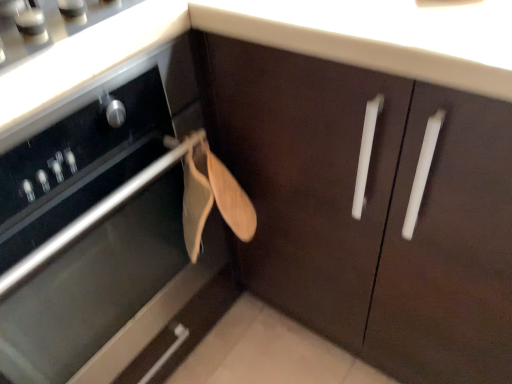
Where is `satin silver gas stove at upper left`? satin silver gas stove at upper left is located at coordinates pyautogui.click(x=48, y=23).

In order to face satin silver gas stove at upper left, should I rotate leftwards or rightwards?

Rotate left and turn 29.077 degrees.

This screenshot has width=512, height=384. What do you see at coordinates (48, 23) in the screenshot? I see `satin silver gas stove at upper left` at bounding box center [48, 23].

What is the approximate width of satin silver gas stove at upper left?

15.15 inches.

What do you see at coordinates (119, 297) in the screenshot?
I see `brown matte cabinet at center` at bounding box center [119, 297].

The width and height of the screenshot is (512, 384). What are the coordinates of `brown matte cabinet at center` in the screenshot? It's located at (119, 297).

The image size is (512, 384). Identify the location of satin silver gas stove at upper left. (48, 23).

In the image, is brown matte cabinet at center on the left side or the right side of satin silver gas stove at upper left?

From the image, it's evident that brown matte cabinet at center is to the left of satin silver gas stove at upper left.

Between brown matte cabinet at center and satin silver gas stove at upper left, which one is positioned behind?

satin silver gas stove at upper left is behind.

Does point (203, 276) lie in front of point (19, 18)?

No, (203, 276) is further to viewer.

From the image's perspective, which is above, brown matte cabinet at center or satin silver gas stove at upper left?

satin silver gas stove at upper left appears higher in the image.

From a real-world perspective, which is physically above, brown matte cabinet at center or satin silver gas stove at upper left?

satin silver gas stove at upper left.

Which of these two, brown matte cabinet at center or satin silver gas stove at upper left, is wider?

Wider between the two is brown matte cabinet at center.

Does brown matte cabinet at center have a greater height compared to satin silver gas stove at upper left?

Correct, brown matte cabinet at center is much taller as satin silver gas stove at upper left.

Who is smaller, brown matte cabinet at center or satin silver gas stove at upper left?

satin silver gas stove at upper left is smaller.

Is satin silver gas stove at upper left inside brown matte cabinet at center?

No, satin silver gas stove at upper left is not a part of brown matte cabinet at center.

Is brown matte cabinet at center far away from satin silver gas stove at upper left?

No, there isn't a large distance between brown matte cabinet at center and satin silver gas stove at upper left.

Is brown matte cabinet at center oriented away from satin silver gas stove at upper left?

No, brown matte cabinet at center is not facing the opposite direction of satin silver gas stove at upper left.

Measure the distance from brown matte cabinet at center to satin silver gas stove at upper left.

brown matte cabinet at center is 35.76 centimeters away from satin silver gas stove at upper left.

The height and width of the screenshot is (384, 512). I want to click on gas stove above the brown matte cabinet at center (from the image's perspective), so click(x=48, y=23).

Based on the photo, between satin silver gas stove at upper left and brown matte cabinet at center, which one appears on the right side from the viewer's perspective?

Positioned to the right is satin silver gas stove at upper left.

Does satin silver gas stove at upper left lie in front of brown matte cabinet at center?

No, satin silver gas stove at upper left is further to the viewer.

Is point (58, 39) more distant than point (142, 161)?

No, it is not.

From the image's perspective, is satin silver gas stove at upper left over brown matte cabinet at center?

Yes.

From a real-world perspective, is satin silver gas stove at upper left above or below brown matte cabinet at center?

satin silver gas stove at upper left is situated higher than brown matte cabinet at center in the real world.

Looking at their sizes, would you say satin silver gas stove at upper left is wider or thinner than brown matte cabinet at center?

Considering their sizes, satin silver gas stove at upper left looks slimmer than brown matte cabinet at center.

Considering the relative sizes of satin silver gas stove at upper left and brown matte cabinet at center in the image provided, is satin silver gas stove at upper left shorter than brown matte cabinet at center?

Yes.

Which of these two, satin silver gas stove at upper left or brown matte cabinet at center, is smaller?

Smaller between the two is satin silver gas stove at upper left.

Based on the photo, is satin silver gas stove at upper left positioned beyond the bounds of brown matte cabinet at center?

Yes, satin silver gas stove at upper left is outside of brown matte cabinet at center.

Is satin silver gas stove at upper left next to brown matte cabinet at center and touching it?

A: There is a gap between satin silver gas stove at upper left and brown matte cabinet at center.

Is satin silver gas stove at upper left aimed at brown matte cabinet at center?

No, satin silver gas stove at upper left is not aimed at brown matte cabinet at center.

How many degrees apart are the facing directions of satin silver gas stove at upper left and brown matte cabinet at center?

The angular difference between satin silver gas stove at upper left and brown matte cabinet at center is 0.000301 degrees.

Identify the location of cabinetry in front of the satin silver gas stove at upper left. tap(119, 297).

Identify the location of cabinetry in front of the satin silver gas stove at upper left. Image resolution: width=512 pixels, height=384 pixels. (119, 297).

Identify the location of gas stove behind the brown matte cabinet at center. (48, 23).